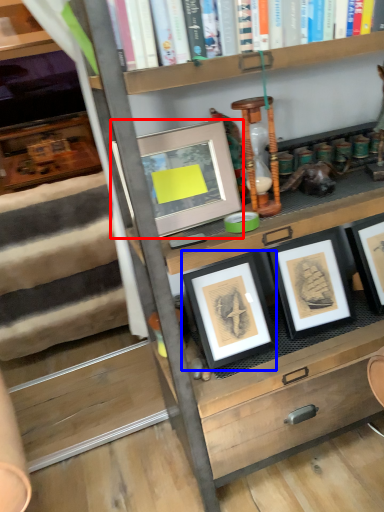
Question: Which of the following is the closest to the observer, picture frame (highlighted by a red box) or picture frame (highlighted by a blue box)?

Choices:
 (A) picture frame
 (B) picture frame

Answer: (A)